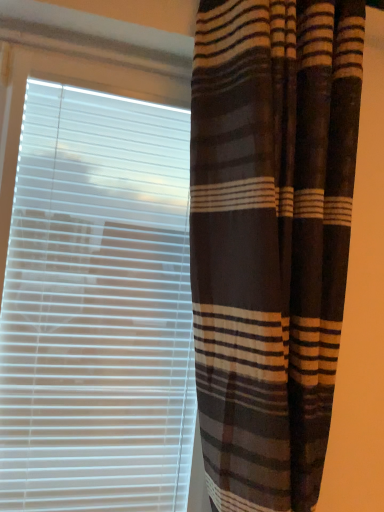
Question: In terms of width, does white plastic blinds at left look wider or thinner when compared to brown striped curtain at right?

Choices:
 (A) wide
 (B) thin

Answer: (B)

Question: Looking at the image, does white plastic blinds at left seem bigger or smaller compared to brown striped curtain at right?

Choices:
 (A) small
 (B) big

Answer: (A)

Question: Which is correct: white plastic blinds at left is inside brown striped curtain at right, or outside of it?

Choices:
 (A) outside
 (B) inside

Answer: (A)

Question: Is brown striped curtain at right spatially inside white plastic blinds at left, or outside of it?

Choices:
 (A) outside
 (B) inside

Answer: (A)

Question: From a real-world perspective, is brown striped curtain at right positioned above or below white plastic blinds at left?

Choices:
 (A) below
 (B) above

Answer: (B)

Question: Considering the positions of brown striped curtain at right and white plastic blinds at left in the image, is brown striped curtain at right wider or thinner than white plastic blinds at left?

Choices:
 (A) wide
 (B) thin

Answer: (A)

Question: Is brown striped curtain at right taller or shorter than white plastic blinds at left?

Choices:
 (A) tall
 (B) short

Answer: (A)